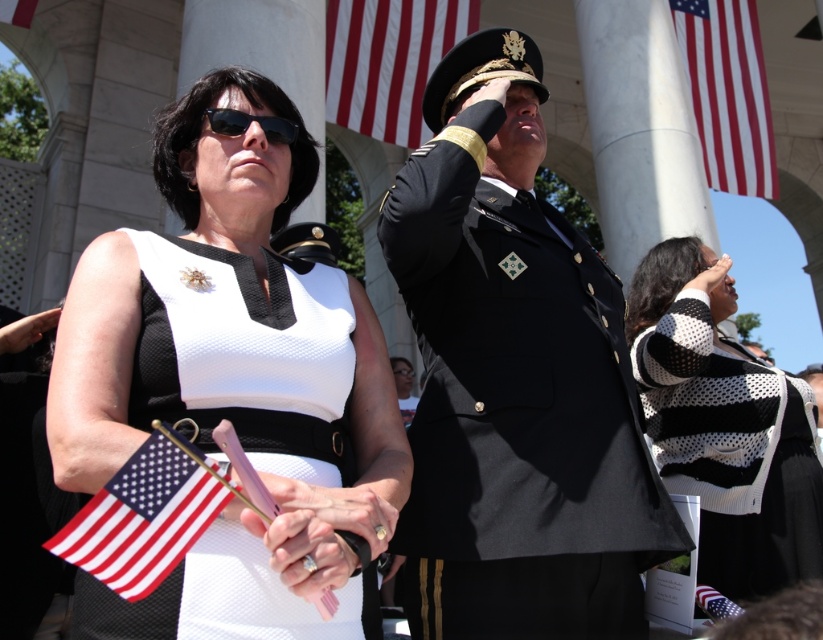
Question: Is matte fabric flag at lower left closer to the viewer compared to black matte sunglasses at upper left?

Choices:
 (A) yes
 (B) no

Answer: (A)

Question: Is matte fabric flag at lower left in front of matte black uniform at center?

Choices:
 (A) yes
 (B) no

Answer: (A)

Question: Can you confirm if shiny black uniform at center is bigger than red fabric flag at upper right?

Choices:
 (A) no
 (B) yes

Answer: (A)

Question: Which of the following is the farthest from the observer?

Choices:
 (A) click(x=538, y=355)
 (B) click(x=747, y=192)
 (C) click(x=268, y=387)
 (D) click(x=463, y=26)

Answer: (B)

Question: Which point appears farthest from the camera in this image?

Choices:
 (A) (407, 378)
 (B) (701, 589)
 (C) (212, 116)

Answer: (A)

Question: Which point appears closest to the camera in this image?

Choices:
 (A) (722, 596)
 (B) (123, 593)
 (C) (529, 188)

Answer: (B)